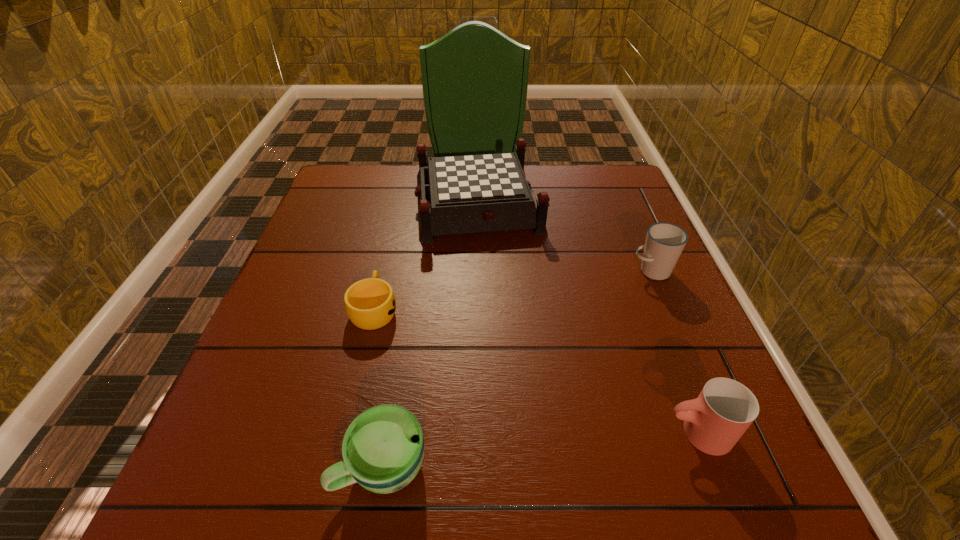
Where is `object that is at the near edge`? This screenshot has width=960, height=540. object that is at the near edge is located at coordinates click(383, 448).

At what (x,y) coordinates should I click in order to perform the action: click on free space at the far edge. Please return your answer as a coordinate pair (x, y). The height and width of the screenshot is (540, 960). Looking at the image, I should click on (406, 173).

Find the location of a particular element. Image resolution: width=960 pixels, height=540 pixels. blank area at the near edge is located at coordinates (518, 507).

This screenshot has width=960, height=540. In the image, there is a desktop. Find the location of `vacant space at the left edge`. vacant space at the left edge is located at coordinates (261, 447).

In order to click on vacant area at the right edge of the desktop in this screenshot , I will do `click(676, 383)`.

Locate an element on the screen. The image size is (960, 540). vacant region at the far right corner is located at coordinates (596, 166).

Locate an element on the screen. free space at the near right corner of the desktop is located at coordinates (723, 505).

Image resolution: width=960 pixels, height=540 pixels. I want to click on free space between the farthest cup and the third farthest object, so click(513, 290).

Locate an element on the screen. The height and width of the screenshot is (540, 960). vacant space that's between the checkerboard and the farthest cup is located at coordinates (564, 238).

At what (x,y) coordinates should I click in order to perform the action: click on free space that is in between the checkerboard and the third nearest object. Please return your answer as a coordinate pair (x, y). Looking at the image, I should click on (426, 256).